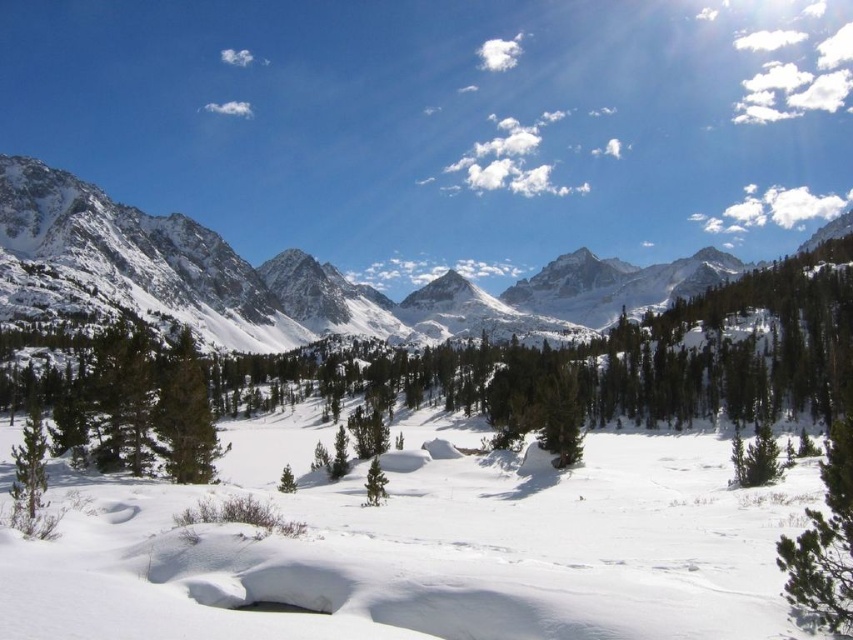
Question: Is white fluffy snow at center above white snow-covered mountain at center?

Choices:
 (A) no
 (B) yes

Answer: (A)

Question: Which of the following is the farthest from the observer?

Choices:
 (A) white snow-covered mountain at center
 (B) white fluffy snow at center

Answer: (A)

Question: Which object appears closest to the camera in this image?

Choices:
 (A) white snow-covered mountain at center
 (B) white fluffy snow at center

Answer: (B)

Question: In this image, where is white fluffy snow at center located relative to white snow-covered mountain at center?

Choices:
 (A) below
 (B) above

Answer: (A)

Question: Considering the relative positions of white fluffy snow at center and white snow-covered mountain at center in the image provided, where is white fluffy snow at center located with respect to white snow-covered mountain at center?

Choices:
 (A) below
 (B) above

Answer: (A)